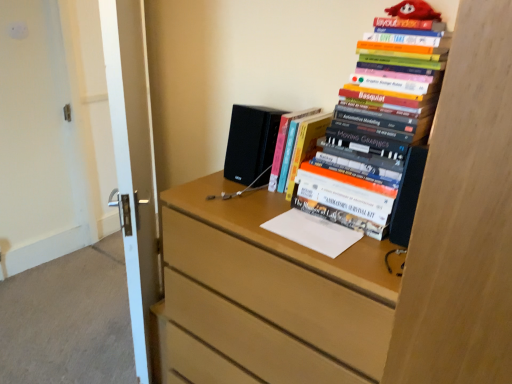
Question: Can you see light wood chest of drawers at center touching white glossy door at left?

Choices:
 (A) yes
 (B) no

Answer: (B)

Question: From a real-world perspective, is light wood chest of drawers at center physically below white glossy door at left?

Choices:
 (A) yes
 (B) no

Answer: (A)

Question: Is light wood chest of drawers at center positioned with its back to white glossy door at left?

Choices:
 (A) no
 (B) yes

Answer: (A)

Question: From the image's perspective, is light wood chest of drawers at center located above white glossy door at left?

Choices:
 (A) yes
 (B) no

Answer: (B)

Question: Does light wood chest of drawers at center have a lesser width compared to white glossy door at left?

Choices:
 (A) yes
 (B) no

Answer: (B)

Question: Does light wood chest of drawers at center contain white glossy door at left?

Choices:
 (A) yes
 (B) no

Answer: (B)

Question: Is black matte speaker at center oriented away from white glossy door at left?

Choices:
 (A) yes
 (B) no

Answer: (B)

Question: From a real-world perspective, is black matte speaker at center over white glossy door at left?

Choices:
 (A) yes
 (B) no

Answer: (A)

Question: Does black matte speaker at center turn towards white glossy door at left?

Choices:
 (A) no
 (B) yes

Answer: (A)

Question: Is black matte speaker at center thinner than white glossy door at left?

Choices:
 (A) no
 (B) yes

Answer: (A)

Question: Is the surface of black matte speaker at center in direct contact with white glossy door at left?

Choices:
 (A) no
 (B) yes

Answer: (A)

Question: From the image's perspective, is black matte speaker at center under white glossy door at left?

Choices:
 (A) yes
 (B) no

Answer: (B)

Question: Would you say white glossy door at left is outside light wood chest of drawers at center?

Choices:
 (A) yes
 (B) no

Answer: (A)